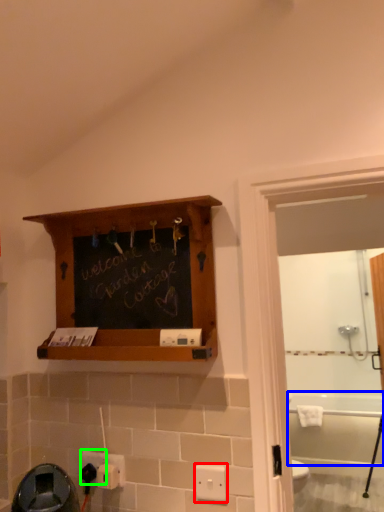
Question: Based on their relative distances, which object is farther from light switch (highlighted by a red box)? Choose from bath (highlighted by a blue box) and electric outlet (highlighted by a green box).

Choices:
 (A) bath
 (B) electric outlet

Answer: (A)